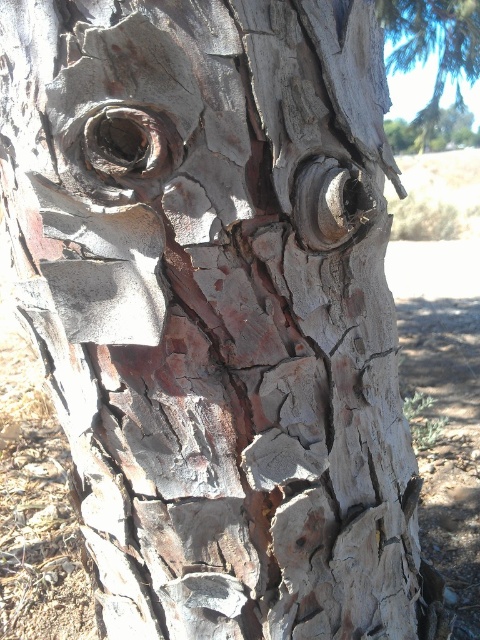
Question: Among these points, which one is farthest from the camera?

Choices:
 (A) (415, 132)
 (B) (396, 4)

Answer: (A)

Question: Does cracked bark tree trunk at upper right have a larger size compared to cracked bark tree trunk at center?

Choices:
 (A) yes
 (B) no

Answer: (A)

Question: Considering the relative positions of cracked bark tree trunk at upper right and cracked bark tree trunk at center in the image provided, where is cracked bark tree trunk at upper right located with respect to cracked bark tree trunk at center?

Choices:
 (A) right
 (B) left

Answer: (B)

Question: Is cracked bark tree trunk at upper right thinner than cracked bark tree trunk at center?

Choices:
 (A) yes
 (B) no

Answer: (B)